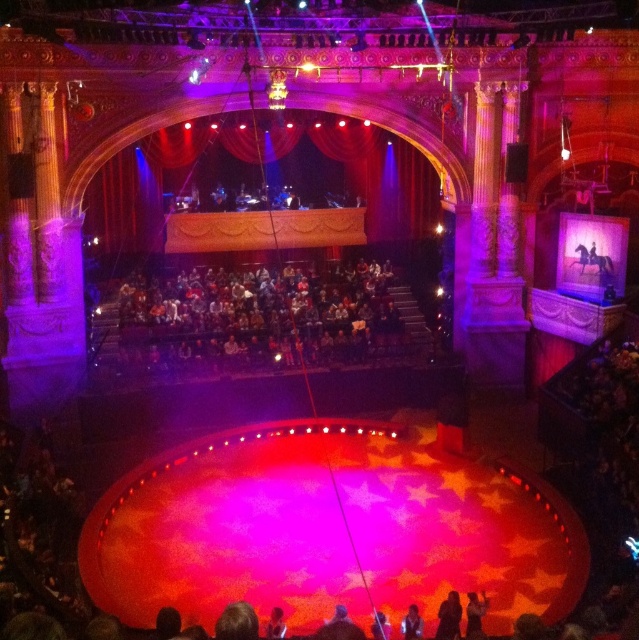
Can you confirm if dark gray fabric crowd at center is positioned to the left of smooth skin face at center?

Yes, dark gray fabric crowd at center is to the left of smooth skin face at center.

Can you confirm if dark gray fabric crowd at center is taller than smooth skin face at center?

Yes, dark gray fabric crowd at center is taller than smooth skin face at center.

Who is more forward, (362,276) or (419,628)?

Point (419,628) is in front.

Where is `dark gray fabric crowd at center`? Image resolution: width=639 pixels, height=640 pixels. dark gray fabric crowd at center is located at coordinates (258, 317).

In the scene shown: Who is higher up, dark brown leather jacket at lower center or smooth skin face at center?

dark brown leather jacket at lower center

Does dark brown leather jacket at lower center appear on the right side of smooth skin face at center?

Correct, you'll find dark brown leather jacket at lower center to the right of smooth skin face at center.

Does point (477, 630) come behind point (412, 605)?

No, (477, 630) is closer to viewer.

Locate an element on the screen. The width and height of the screenshot is (639, 640). dark brown leather jacket at lower center is located at coordinates (473, 614).

Is the position of dark gray fabric crowd at center more distant than that of dark brown leather jacket at lower center?

Yes, it is.

Can you confirm if dark gray fabric crowd at center is shorter than dark brown leather jacket at lower center?

No, dark gray fabric crowd at center is not shorter than dark brown leather jacket at lower center.

Between point (351, 269) and point (481, 628), which one is positioned behind?

Positioned behind is point (351, 269).

Where is `dark gray fabric crowd at center`? Image resolution: width=639 pixels, height=640 pixels. dark gray fabric crowd at center is located at coordinates (258, 317).